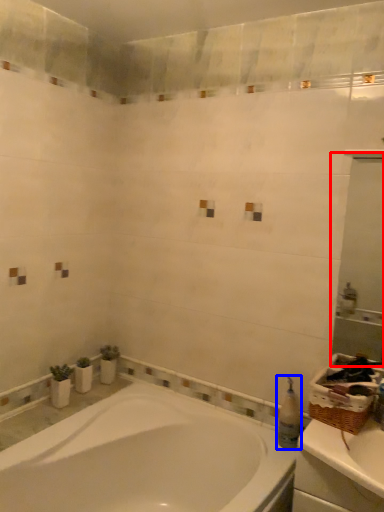
Question: Which object is closer to the camera taking this photo, mirror (highlighted by a red box) or toiletry (highlighted by a blue box)?

Choices:
 (A) mirror
 (B) toiletry

Answer: (A)